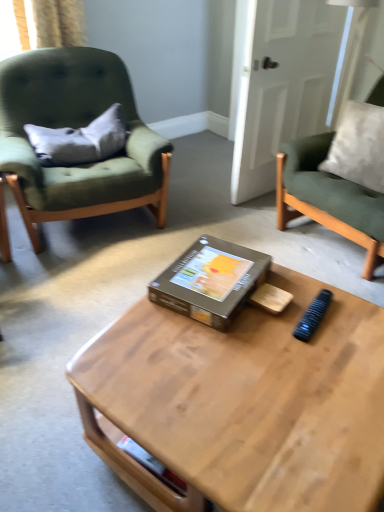
You are a GUI agent. You are given a task and a screenshot of the screen. Output one action in this format:
    pyautogui.click(x=<x>, y=<y>)
    Task: Click on the unoccupied area in front of brown cardboard box at center
    Image resolution: width=384 pixels, height=512 pixels.
    Given the screenshot: What is the action you would take?
    pyautogui.click(x=224, y=352)